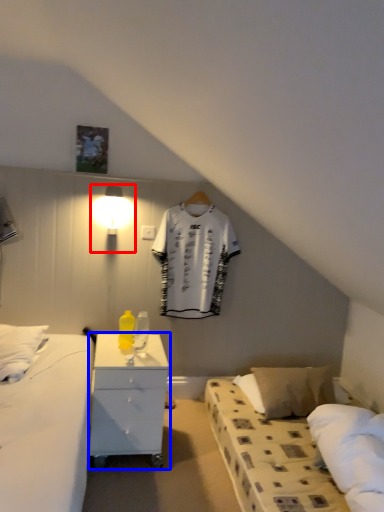
Question: Which object is closer to the camera taking this photo, light fixture (highlighted by a red box) or nightstand (highlighted by a blue box)?

Choices:
 (A) light fixture
 (B) nightstand

Answer: (B)